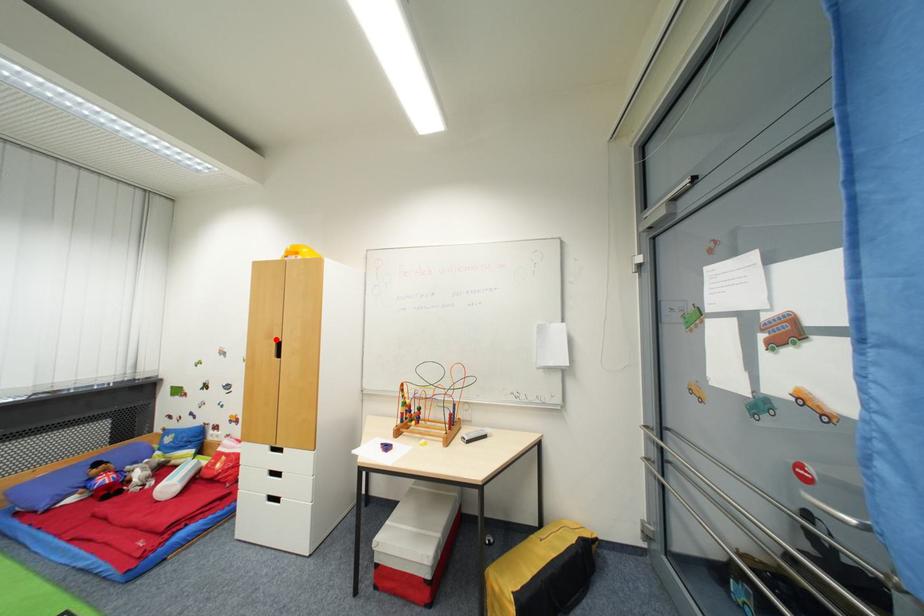
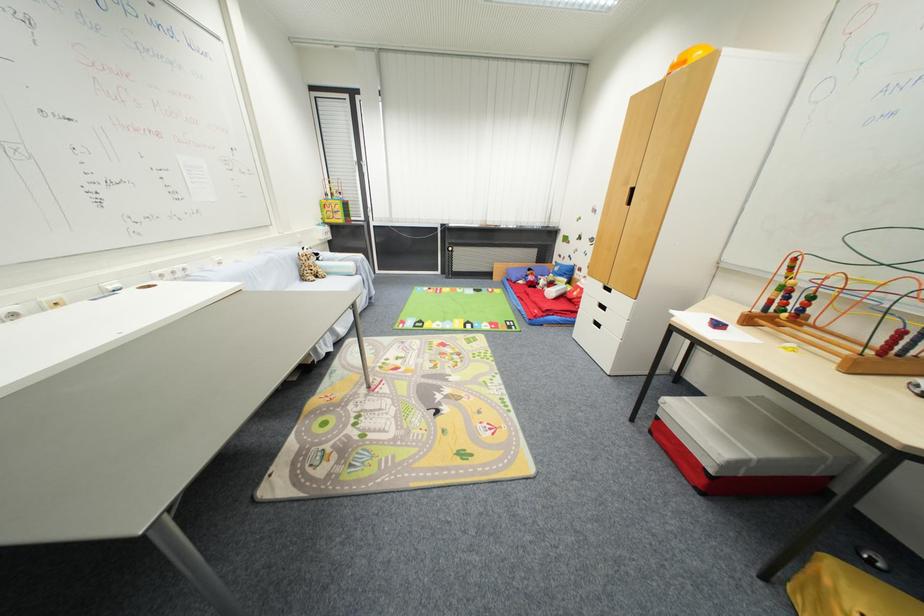
Question: I am providing you with two images of the same scene from different viewpoints. A red point is marked on the first image. Can you still see the location of the red point in image 2?

Choices:
 (A) Yes
 (B) No

Answer: (A)